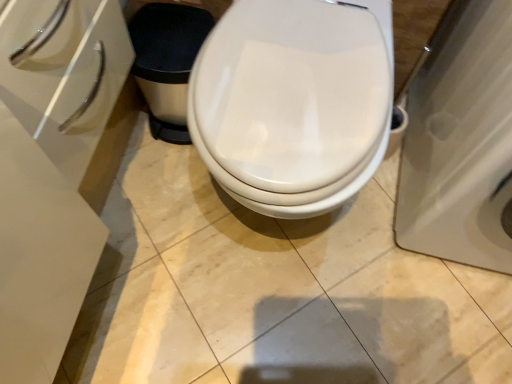
Question: Considering the relative sizes of white glossy toilet at center and white glossy porcelain at right in the image provided, is white glossy toilet at center thinner than white glossy porcelain at right?

Choices:
 (A) yes
 (B) no

Answer: (A)

Question: From the image's perspective, does white glossy toilet at center appear lower than white glossy porcelain at right?

Choices:
 (A) no
 (B) yes

Answer: (B)

Question: Is white glossy toilet at center facing towards white glossy porcelain at right?

Choices:
 (A) no
 (B) yes

Answer: (A)

Question: Does white glossy toilet at center have a greater height compared to white glossy porcelain at right?

Choices:
 (A) yes
 (B) no

Answer: (B)

Question: Would you say white glossy porcelain at right is part of white glossy toilet at center's contents?

Choices:
 (A) yes
 (B) no

Answer: (B)

Question: Are white glossy toilet at center and white glossy porcelain at right located far from each other?

Choices:
 (A) yes
 (B) no

Answer: (B)

Question: Is the position of white glossy porcelain at right less distant than that of white glossy toilet at center?

Choices:
 (A) no
 (B) yes

Answer: (B)

Question: Is white glossy porcelain at right shorter than white glossy toilet at center?

Choices:
 (A) yes
 (B) no

Answer: (B)

Question: Could you tell me if white glossy porcelain at right is turned towards white glossy toilet at center?

Choices:
 (A) yes
 (B) no

Answer: (B)

Question: Is white glossy porcelain at right directly adjacent to white glossy toilet at center?

Choices:
 (A) no
 (B) yes

Answer: (A)

Question: From the image's perspective, is white glossy porcelain at right beneath white glossy toilet at center?

Choices:
 (A) yes
 (B) no

Answer: (B)

Question: Can you confirm if white glossy porcelain at right is taller than white glossy toilet at center?

Choices:
 (A) no
 (B) yes

Answer: (B)

Question: Which is correct: white glossy porcelain at right is inside white glossy toilet at center, or outside of it?

Choices:
 (A) outside
 (B) inside

Answer: (A)